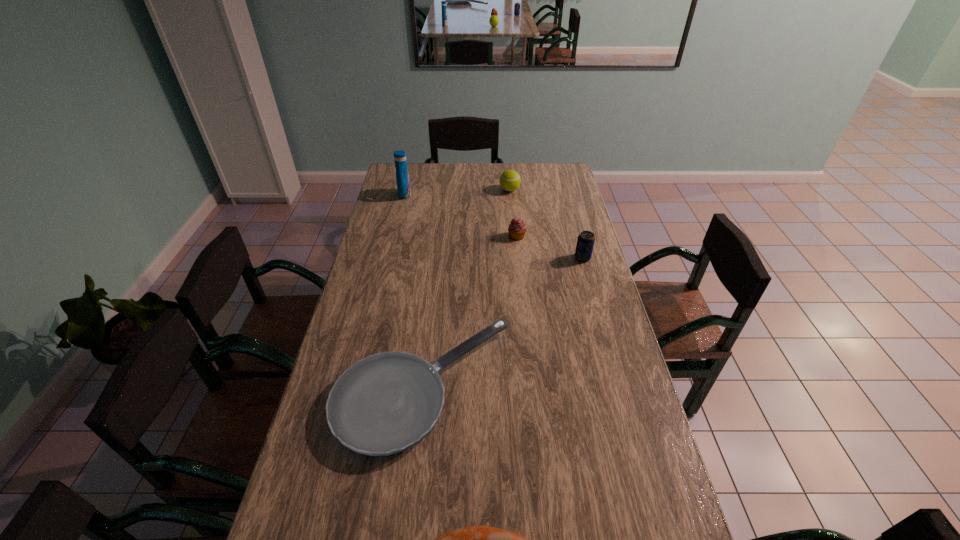
Where is `the tallest object`? the tallest object is located at coordinates (402, 177).

Find the location of a particular element. soda is located at coordinates (585, 243).

The width and height of the screenshot is (960, 540). I want to click on the rightmost object, so click(x=585, y=243).

Find the location of a particular element. This screenshot has width=960, height=540. tennis ball is located at coordinates (510, 180).

Find the location of `cupcake`. cupcake is located at coordinates (517, 228).

Where is `the fifth farthest object`? The height and width of the screenshot is (540, 960). the fifth farthest object is located at coordinates (384, 404).

At what (x,y) coordinates should I click in order to perform the action: click on blank area located 0.130m on the front-facing side of the detergent. Please return your answer as a coordinate pair (x, y). Image resolution: width=960 pixels, height=540 pixels. Looking at the image, I should click on click(x=439, y=194).

The width and height of the screenshot is (960, 540). What are the coordinates of `free space located on the front of the soda` in the screenshot? It's located at (589, 282).

Where is `vacant space located 0.110m on the front of the tennis ball`? vacant space located 0.110m on the front of the tennis ball is located at coordinates (512, 208).

Identify the location of free space located on the back of the cupcake. (515, 213).